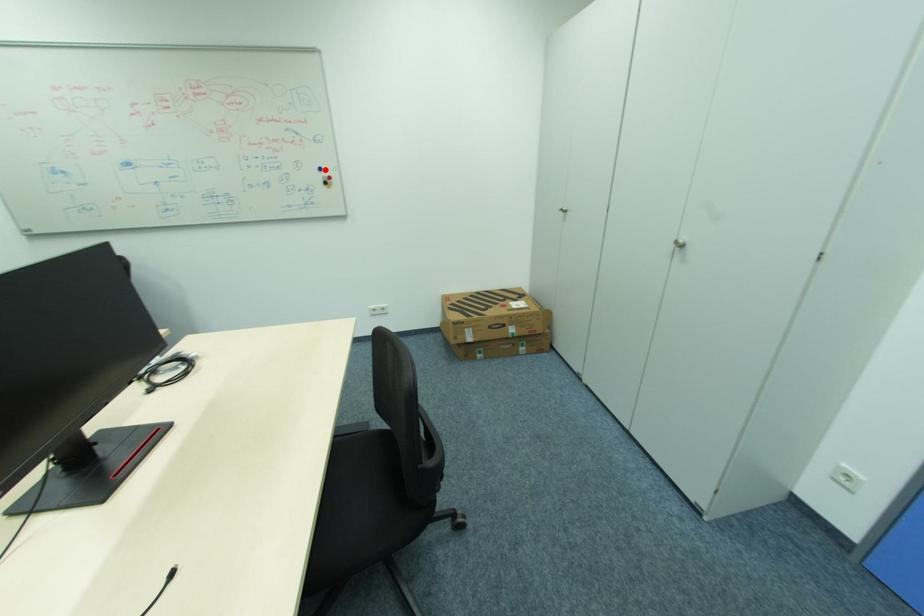
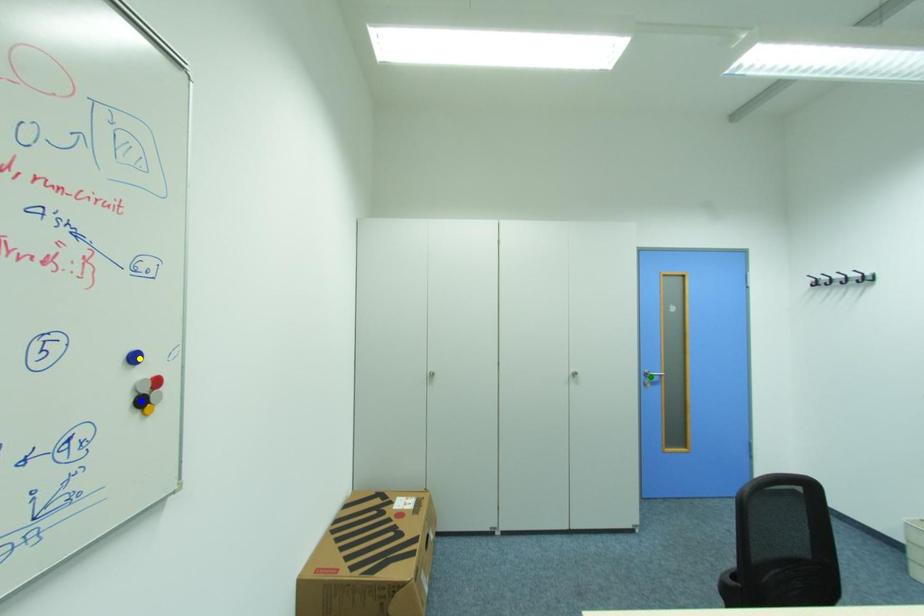
Question: I am providing you with two images of the same scene from different viewpoints. A red point is marked on the first image. You are given multiple points on the second image. Which point in image 2 represents the same 3d spot as the red point in image 1?

Choices:
 (A) yellow point
 (B) green point
 (C) blue point

Answer: (A)